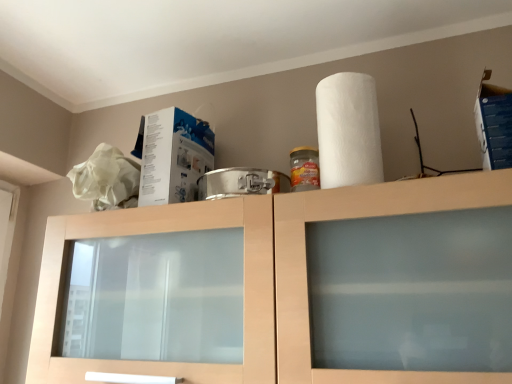
Question: Looking at the image, does white cardboard box at upper left, arranged as the 2th box when viewed from the front, seem bigger or smaller compared to blue cardboard box at upper right, acting as the 2th box starting from the left?

Choices:
 (A) big
 (B) small

Answer: (A)

Question: From the image's perspective, relative to blue cardboard box at upper right, which is the 1th box from right to left, is white cardboard box at upper left, the first box positioned from the back, above or below?

Choices:
 (A) above
 (B) below

Answer: (B)

Question: Based on their relative distances, which object is nearer to the white textured paper towel at upper right?

Choices:
 (A) matte wood cabinet at center
 (B) blue cardboard box at upper right, acting as the 2th box starting from the left
 (C) white cardboard box at upper left, marked as the 2th box in a right-to-left arrangement

Answer: (A)

Question: Which is nearer to the white cardboard box at upper left, marked as the 2th box in a right-to-left arrangement?

Choices:
 (A) matte wood cabinet at center
 (B) white textured paper towel at upper right
 (C) blue cardboard box at upper right, the 2th box from the back

Answer: (A)